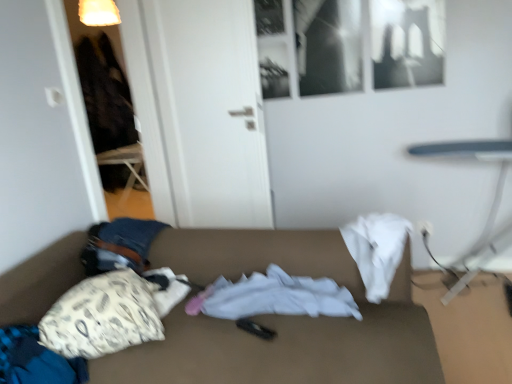
Question: From a real-world perspective, is smooth white table at right below white fabric pillow at lower left?

Choices:
 (A) no
 (B) yes

Answer: (B)

Question: Considering the relative sizes of smooth white table at right and white fabric pillow at lower left in the image provided, is smooth white table at right bigger than white fabric pillow at lower left?

Choices:
 (A) yes
 (B) no

Answer: (A)

Question: Considering the relative sizes of smooth white table at right and white fabric pillow at lower left in the image provided, is smooth white table at right shorter than white fabric pillow at lower left?

Choices:
 (A) no
 (B) yes

Answer: (A)

Question: Does smooth white table at right have a greater width compared to white fabric pillow at lower left?

Choices:
 (A) yes
 (B) no

Answer: (A)

Question: From a real-world perspective, is smooth white table at right positioned over white fabric pillow at lower left based on gravity?

Choices:
 (A) yes
 (B) no

Answer: (B)

Question: From the image's perspective, relative to white fabric at center, is white fabric couch at center above or below?

Choices:
 (A) above
 (B) below

Answer: (B)

Question: From a real-world perspective, relative to white fabric at center, is white fabric couch at center vertically above or below?

Choices:
 (A) above
 (B) below

Answer: (B)

Question: In the image, is white fabric couch at center on the left side or the right side of white fabric at center?

Choices:
 (A) left
 (B) right

Answer: (A)

Question: Would you say white fabric couch at center is inside or outside white fabric at center?

Choices:
 (A) inside
 (B) outside

Answer: (B)

Question: From the image's perspective, is white fabric pillow at lower left located above or below smooth white table at right?

Choices:
 (A) below
 (B) above

Answer: (A)

Question: Based on their sizes in the image, would you say white fabric pillow at lower left is bigger or smaller than smooth white table at right?

Choices:
 (A) small
 (B) big

Answer: (A)

Question: Relative to smooth white table at right, is white fabric pillow at lower left in front or behind?

Choices:
 (A) front
 (B) behind

Answer: (A)

Question: Looking at their shapes, would you say white fabric pillow at lower left is wider or thinner than smooth white table at right?

Choices:
 (A) wide
 (B) thin

Answer: (B)

Question: Relative to white fabric couch at center, is white fabric at center in front or behind?

Choices:
 (A) behind
 (B) front

Answer: (A)

Question: From the image's perspective, is white fabric at center positioned above or below white fabric couch at center?

Choices:
 (A) above
 (B) below

Answer: (A)